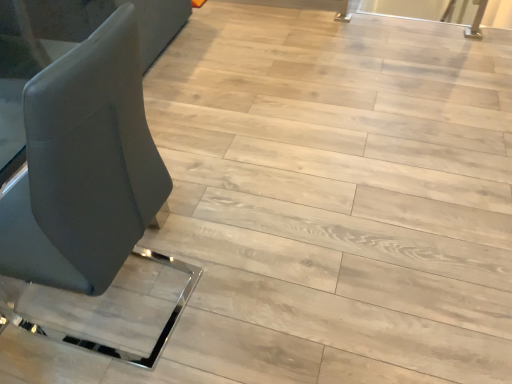
The height and width of the screenshot is (384, 512). Find the location of `vacant location behind matte gray chair at left`. vacant location behind matte gray chair at left is located at coordinates (193, 196).